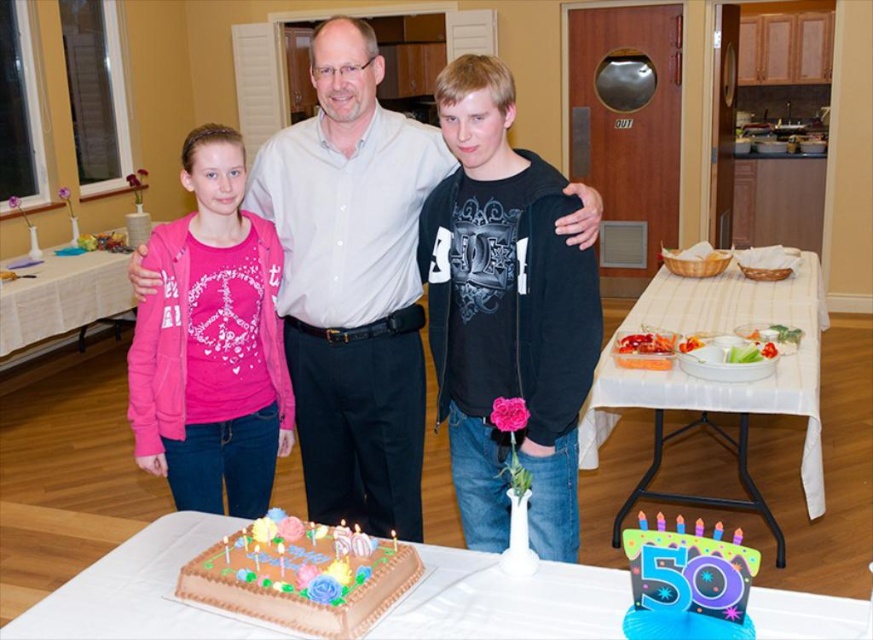
Question: Considering the real-world distances, which object is closest to the chocolate cake at lower left?

Choices:
 (A) black matte hoodie at center
 (B) white plastic table at center
 (C) pink fleece jacket at left

Answer: (C)

Question: Does pink fleece jacket at left come in front of chocolate cake at lower left?

Choices:
 (A) no
 (B) yes

Answer: (A)

Question: Is white plastic table at center further to the viewer compared to white cloth table at lower left?

Choices:
 (A) yes
 (B) no

Answer: (B)

Question: Is chocolate frosted cake at center below white cloth table at lower left?

Choices:
 (A) no
 (B) yes

Answer: (B)

Question: Which point is farther to the camera?

Choices:
 (A) (526, 321)
 (B) (774, 387)
 (C) (169, 396)

Answer: (B)

Question: Which is farther from the white plastic table at center?

Choices:
 (A) matte white shirt at center
 (B) chocolate cake at lower left
 (C) white cloth table at lower left
 (D) black matte hoodie at center

Answer: (C)